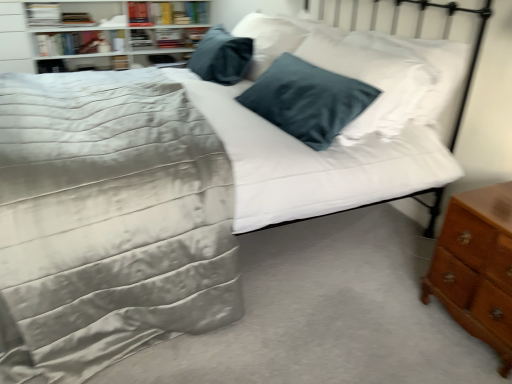
Question: Should I look upward or downward to see hardcover book at upper left, which is the third book from right to left?

Choices:
 (A) up
 (B) down

Answer: (A)

Question: Could white glossy bookshelf at upper left be considered to be inside hardcover book at upper left, placed as the fourth book when sorted from right to left?

Choices:
 (A) yes
 (B) no

Answer: (B)

Question: Is hardcover book at upper left, which is the first book from left to right, directly adjacent to white glossy bookshelf at upper left?

Choices:
 (A) no
 (B) yes

Answer: (A)

Question: From the image's perspective, is hardcover book at upper left, placed as the fourth book when sorted from right to left, below white glossy bookshelf at upper left?

Choices:
 (A) yes
 (B) no

Answer: (B)

Question: Does hardcover book at upper left, placed as the fourth book when sorted from right to left, appear on the right side of white glossy bookshelf at upper left?

Choices:
 (A) yes
 (B) no

Answer: (B)

Question: Is hardcover book at upper left, placed as the fourth book when sorted from right to left, thinner than white glossy bookshelf at upper left?

Choices:
 (A) yes
 (B) no

Answer: (A)

Question: Is hardcover book at upper left, which is the first book from left to right, looking in the opposite direction of white glossy bookshelf at upper left?

Choices:
 (A) yes
 (B) no

Answer: (A)

Question: Is hardcover book at upper left, the second book when ordered from left to right, to the left of hardcover book at upper left, which is the first book from left to right, from the viewer's perspective?

Choices:
 (A) no
 (B) yes

Answer: (A)

Question: Is hardcover book at upper left, which is the third book from right to left, completely or partially outside of hardcover book at upper left, which is the first book from left to right?

Choices:
 (A) no
 (B) yes

Answer: (B)

Question: Considering the relative sizes of hardcover book at upper left, the second book when ordered from left to right, and hardcover book at upper left, placed as the fourth book when sorted from right to left, in the image provided, is hardcover book at upper left, the second book when ordered from left to right, bigger than hardcover book at upper left, placed as the fourth book when sorted from right to left,?

Choices:
 (A) yes
 (B) no

Answer: (A)

Question: From a real-world perspective, is hardcover book at upper left, which is the third book from right to left, on hardcover book at upper left, placed as the fourth book when sorted from right to left?

Choices:
 (A) no
 (B) yes

Answer: (A)

Question: Does hardcover book at upper left, the second book when ordered from left to right, appear on the right side of hardcover book at upper left, which is the first book from left to right?

Choices:
 (A) no
 (B) yes

Answer: (B)

Question: Is hardcover book at upper left, which is the third book from right to left, positioned with its back to hardcover book at upper left, which is the first book from left to right?

Choices:
 (A) yes
 (B) no

Answer: (B)

Question: Can you confirm if brown wooden nightstand at lower right is positioned to the left of white glossy bookshelf at upper left?

Choices:
 (A) no
 (B) yes

Answer: (A)